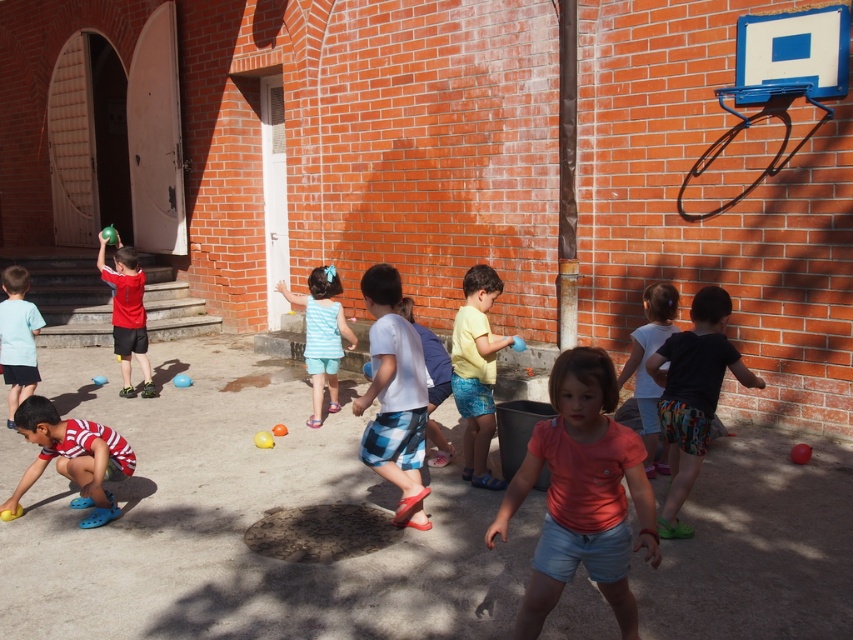
Question: Which point is closer to the camera?

Choices:
 (A) striped cotton shirt at lower left
 (B) white cotton shirt at center
 (C) blue plaid shorts at center

Answer: (C)

Question: Does pink matte shirt at center have a greater width compared to white cotton shirt at center?

Choices:
 (A) no
 (B) yes

Answer: (B)

Question: Is white cotton shirt at center smaller than matte red shirt at left?

Choices:
 (A) yes
 (B) no

Answer: (A)

Question: Which point is closer to the camera taking this photo?

Choices:
 (A) (328, 349)
 (B) (544, 541)

Answer: (B)

Question: Which point is closer to the camera?

Choices:
 (A) white cotton shirt at center
 (B) multicolored shorts at right
 (C) white plaid shorts at center
 (D) matte red shirt at left

Answer: (B)

Question: Is matte red shirt at left below white plaid shorts at center?

Choices:
 (A) yes
 (B) no

Answer: (B)